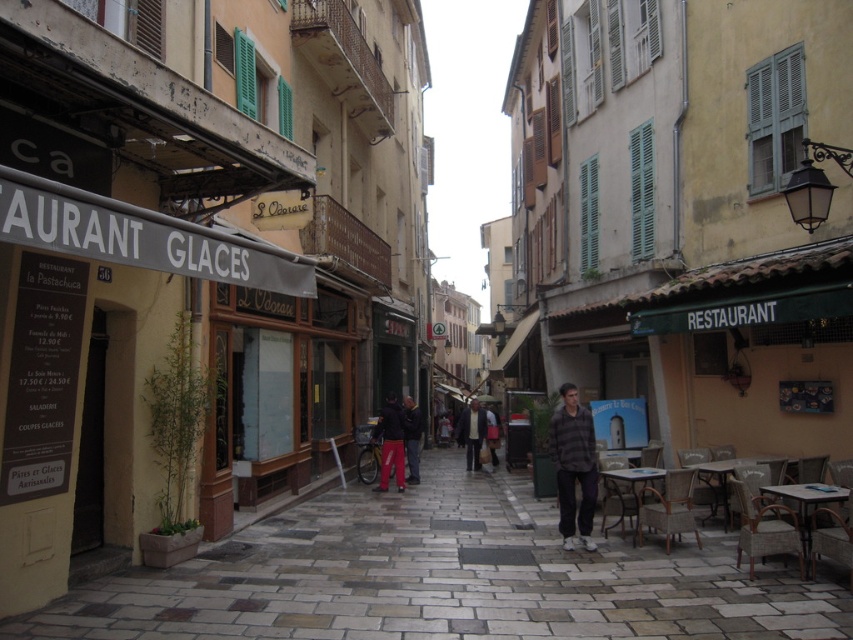
Question: Which object is farther from the camera taking this photo?

Choices:
 (A) dark gray sweater at center
 (B) stone paving at center
 (C) dark gray jacket at center

Answer: (A)

Question: Can you confirm if plaid shirt at center is positioned to the left of dark blue jacket at center?

Choices:
 (A) yes
 (B) no

Answer: (B)

Question: Can you confirm if stone paving at center is thinner than dark blue jacket at center?

Choices:
 (A) no
 (B) yes

Answer: (A)

Question: Which of these objects is positioned farthest from the plaid shirt at center?

Choices:
 (A) stone paving at center
 (B) dark gray jacket at center
 (C) dark gray sweater at center
 (D) dark blue jacket at center

Answer: (C)

Question: Which of the following is the closest to the observer?

Choices:
 (A) (579, 408)
 (B) (393, 524)
 (C) (413, 401)

Answer: (A)

Question: Can you confirm if stone paving at center is wider than dark gray jacket at center?

Choices:
 (A) no
 (B) yes

Answer: (B)